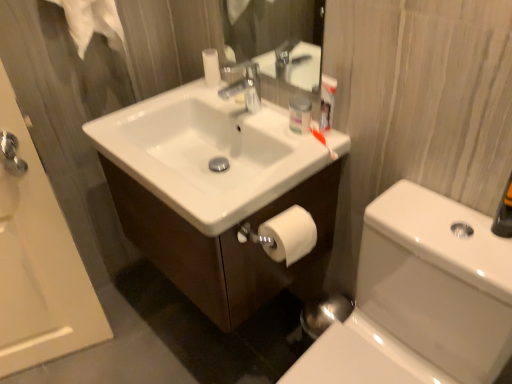
Identify the location of vacant area that lies in front of matte plastic container at upper center. The height and width of the screenshot is (384, 512). (296, 140).